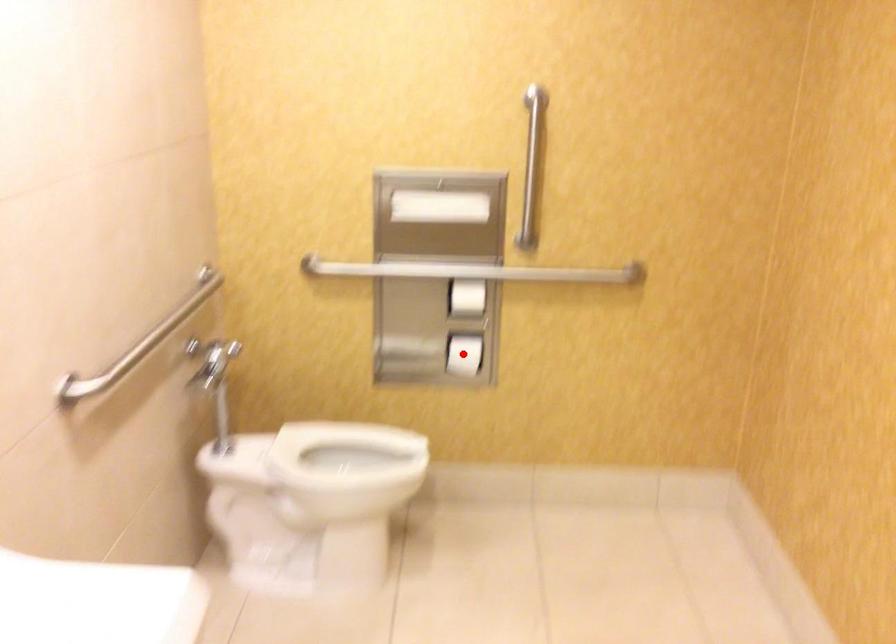
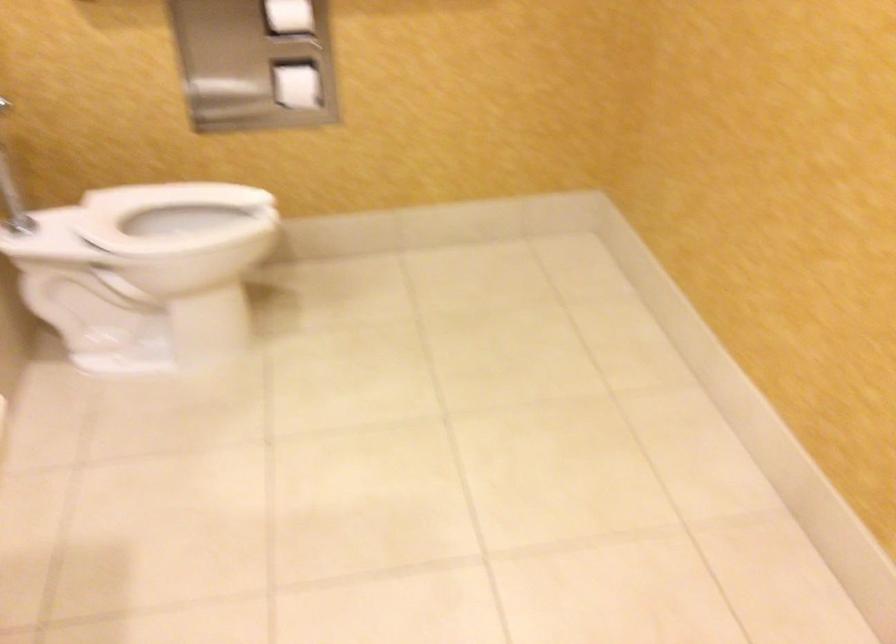
The point at the highlighted location is marked in the first image. Where is the corresponding point in the second image?

(297, 86)